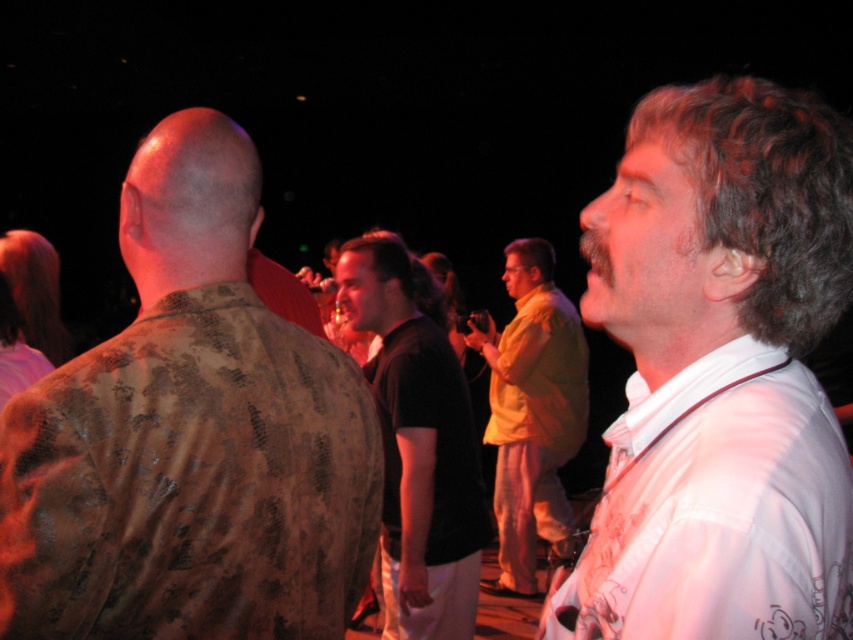
You are standing at the point labeled as point (x=390, y=436) in the image. A friend is holding a flashlight and wants to shine it directly at you. If the flashlight has a maximum range of 10 feet, will the light reach you?

The point labeled as point (x=390, y=436) and the viewer are 8.78 feet apart from each other. Since the flashlight has a maximum range of 10 feet, the light will reach you because 8.78 feet is within the 10 feet range.

You are at a party and want to take a photo of both the camouflage shirt at left and the white satin shirt at right. Which shirt should you position closer to the camera to ensure both are in frame?

You should position the camouflage shirt at left closer to the camera because it is to the left of the white satin shirt at right, so moving it forward will keep both shirts visible in the frame.